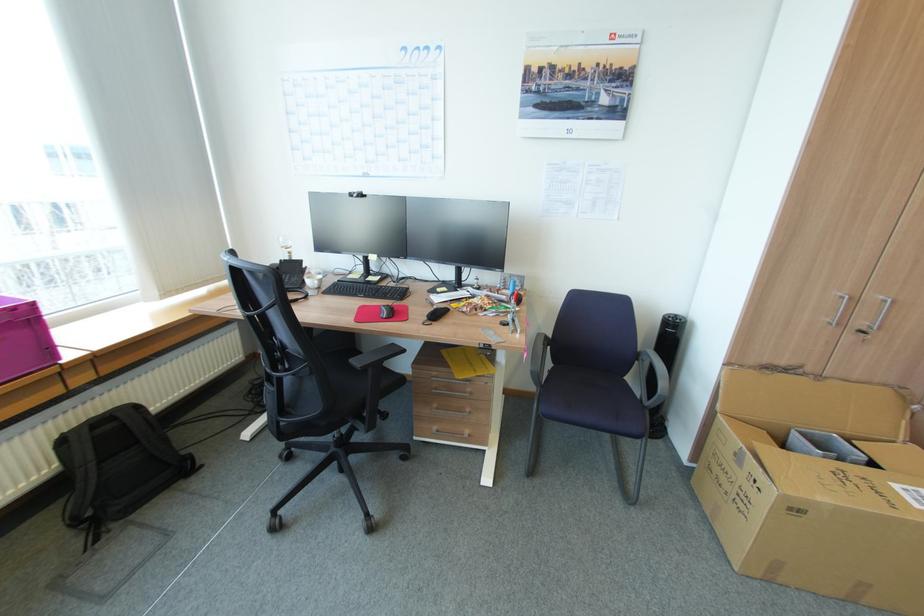
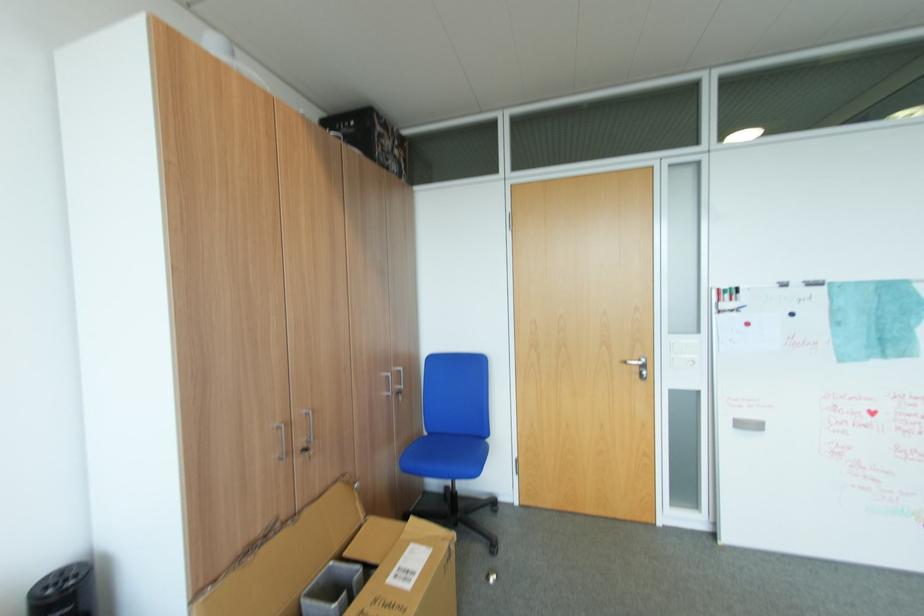
The point at (847, 297) is marked in the first image. Where is the corresponding point in the second image?

(283, 430)